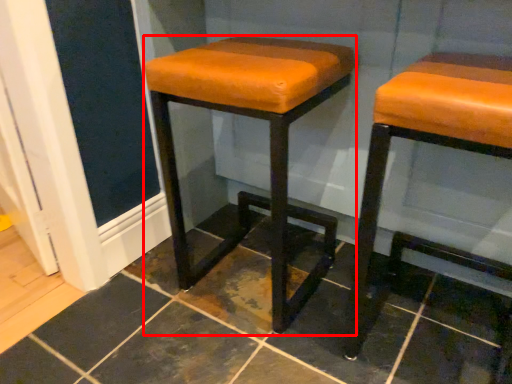
Question: From the image's perspective, where is stool (annotated by the red box) located relative to stool?

Choices:
 (A) above
 (B) below

Answer: (A)